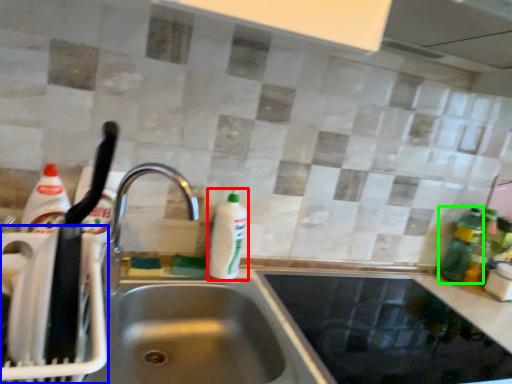
Question: Estimate the real-world distances between objects in this image. Which object is farther from cleaning product (highlighted by a red box), appliance (highlighted by a blue box) or bottle (highlighted by a green box)?

Choices:
 (A) appliance
 (B) bottle

Answer: (B)